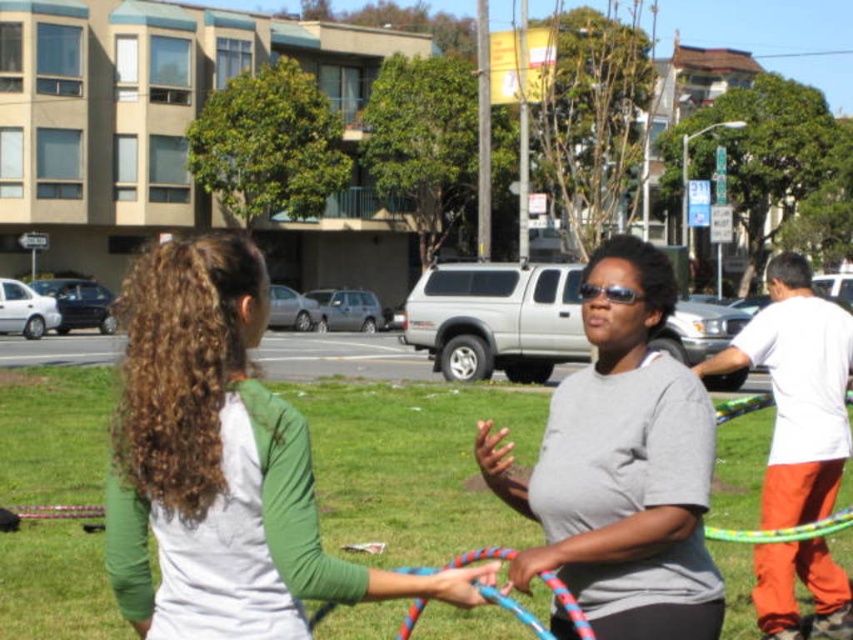
Consider the image. You are standing at the edge of the park and want to find the green grass at center. According to the coordinates provided, in which direction should you move to reach it?

The green grass at center is located at coordinates point (410,467). Since you are at the edge, moving towards the center of the park would lead you to it.